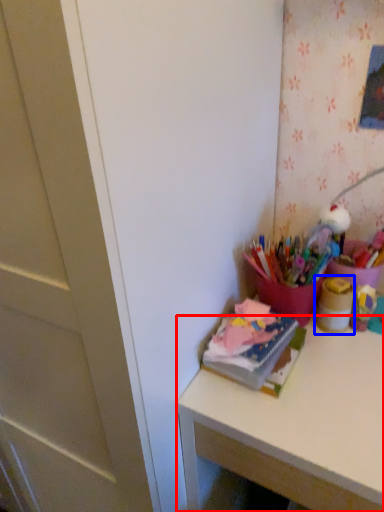
Question: Which point is closer to the camera, desk (highlighted by a red box) or stationery (highlighted by a blue box)?

Choices:
 (A) desk
 (B) stationery

Answer: (A)